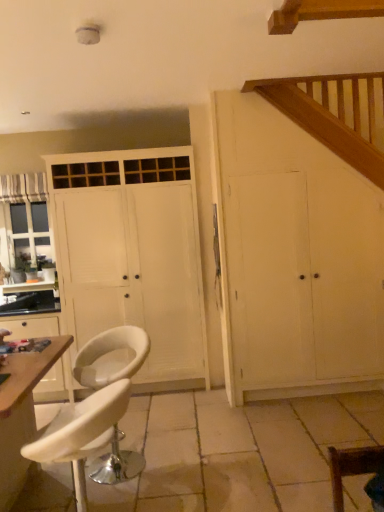
Locate an element on the screen. This screenshot has height=512, width=384. free space that is to the left of white wood cupboard at right, the 1th cupboard viewed from the right is located at coordinates (202, 415).